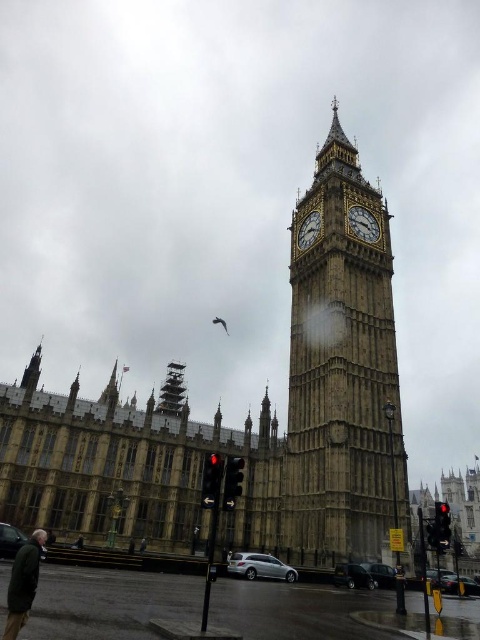
Question: Is stone clock tower at center positioned in front of black matte car at lower left?

Choices:
 (A) yes
 (B) no

Answer: (B)

Question: Which of the following is the closest to the observer?

Choices:
 (A) (239, 563)
 (B) (452, 577)
 (C) (300, 248)
 (D) (1, 548)

Answer: (D)

Question: Which object is farther from the camera taking this photo?

Choices:
 (A) gold textured clock at upper center
 (B) metallic silver car at lower right
 (C) shiny black sedan at lower center
 (D) stone clock tower at center

Answer: (A)

Question: Is dark green jacket at lower left thinner than shiny black sedan at lower center?

Choices:
 (A) yes
 (B) no

Answer: (B)

Question: Does red glass traffic light at lower center appear over black matte car at lower left?

Choices:
 (A) no
 (B) yes

Answer: (B)

Question: Which object is the closest to the red glass traffic light at lower right?

Choices:
 (A) black matte car at lower left
 (B) sleek silver sedan at lower center
 (C) dark green jacket at lower left
 (D) metallic silver car at lower right

Answer: (D)